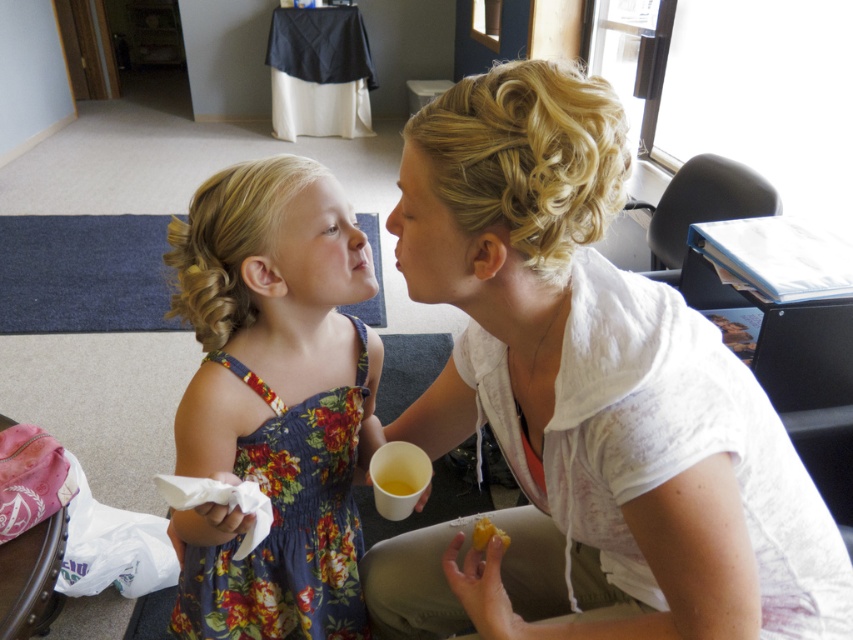
You are a photographer trying to capture a candid shot of the white cotton shirt at upper right and the yellow matte food at lower center. Which object should you focus on first if you want to ensure both are in frame without moving the camera?

The white cotton shirt at upper right is much taller than the yellow matte food at lower center, so focusing on the taller object first would help ensure both are in frame.

You are a photographer setting up for a family portrait. You need to position the white cotton shirt at upper right and the floral fabric dress at center so that they are both visible in the frame. Based on their current positions, which one is lower in the image?

The white cotton shirt at upper right is below the floral fabric dress at center, so it is lower in the image.

You are a photographer setting up a shot of the scene described. You need to position a light source so it illuminates the floral fabric dress at center and the yellow matte food at lower center equally. Considering their positions, where should you place the light source?

The floral fabric dress at center is located above the yellow matte food at lower center. To illuminate both equally, position the light source directly above them so the light can reach both the upper and lower positions without casting shadows that block either object.